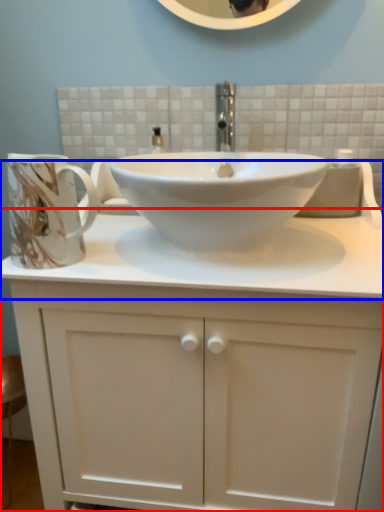
Question: Which object appears farthest to the camera in this image, bathroom cabinet (highlighted by a red box) or counter top (highlighted by a blue box)?

Choices:
 (A) bathroom cabinet
 (B) counter top

Answer: (B)